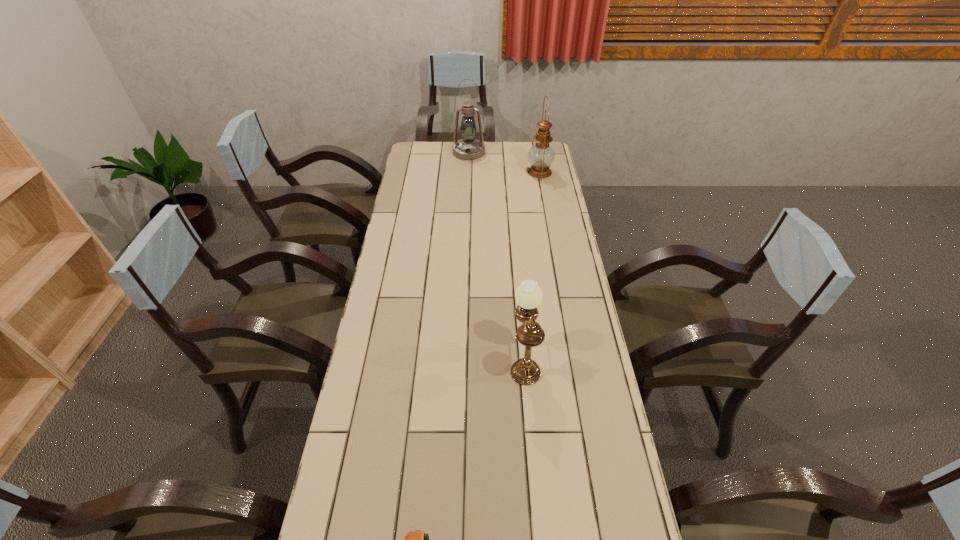
What are the coordinates of `oil lamp that is the second closest to the nearest object` in the screenshot? It's located at (541, 155).

Find the location of a particular element. The image size is (960, 540). vacant space that satisfies the following two spatial constraints: 1. on the back side of the rightmost oil lamp; 2. on the left side of the nearest oil lamp is located at coordinates (509, 172).